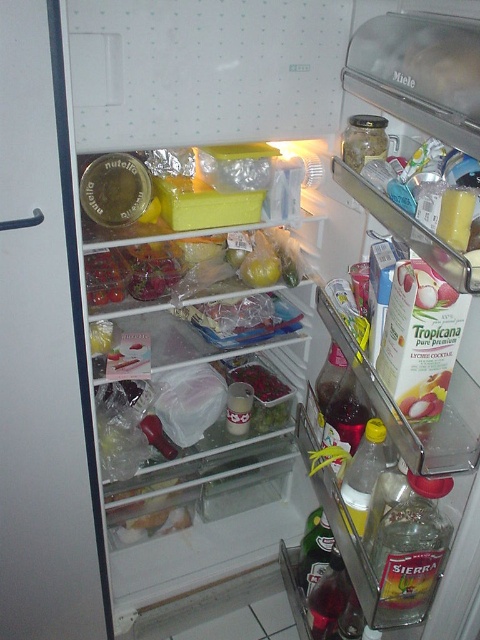
Question: Does matte plastic jar at left appear under green leafy vegetables at center?

Choices:
 (A) no
 (B) yes

Answer: (B)

Question: Among these objects, which one is farthest from the camera?

Choices:
 (A) matte plastic jar at left
 (B) green leafy vegetables at center

Answer: (B)

Question: Does matte plastic jar at left appear over green leafy vegetables at center?

Choices:
 (A) no
 (B) yes

Answer: (A)

Question: Can you confirm if matte plastic jar at left is wider than green leafy vegetables at center?

Choices:
 (A) no
 (B) yes

Answer: (B)